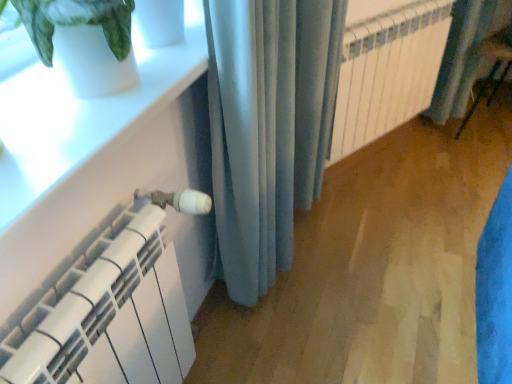
I want to click on empty space that is ontop of white glossy window sill at upper left (from a real-world perspective), so click(x=83, y=102).